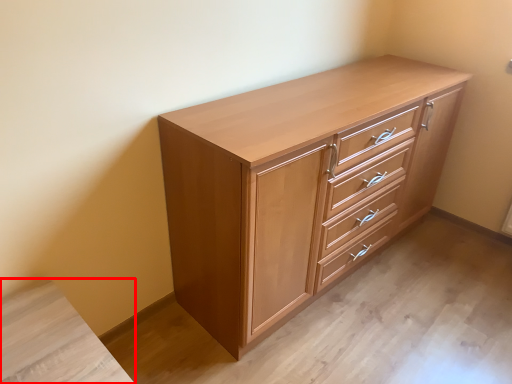
Question: Observing the image, what is the correct spatial positioning of vanity (annotated by the red box) in reference to chest of drawers?

Choices:
 (A) right
 (B) left

Answer: (B)